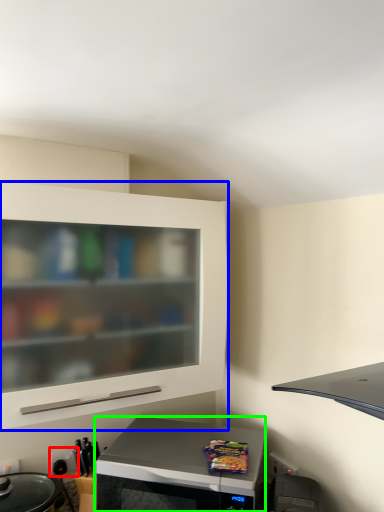
Question: Considering the real-world distances, which object is closest to electric outlet (highlighted by a red box)? cabinetry (highlighted by a blue box) or microwave oven (highlighted by a green box).

Choices:
 (A) cabinetry
 (B) microwave oven

Answer: (B)